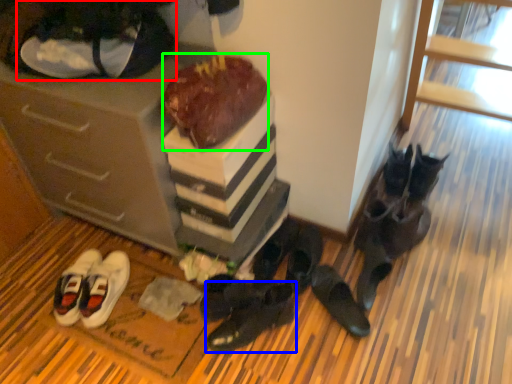
Question: Estimate the real-world distances between objects in this image. Which object is farther from footwear (highlighted by a red box), footwear (highlighted by a blue box) or chocolate cake (highlighted by a green box)?

Choices:
 (A) footwear
 (B) chocolate cake

Answer: (A)